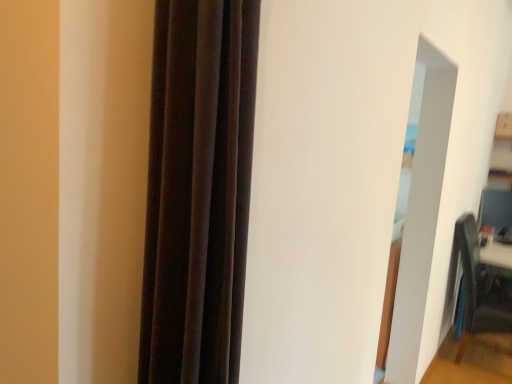
At what (x,y) coordinates should I click in order to perform the action: click on teal fabric armchair at lower right. Please return your answer as a coordinate pair (x, y). The height and width of the screenshot is (384, 512). Looking at the image, I should click on (471, 278).

The height and width of the screenshot is (384, 512). What do you see at coordinates (471, 278) in the screenshot? I see `teal fabric armchair at lower right` at bounding box center [471, 278].

What is the approximate height of teal fabric armchair at lower right?

1.07 meters.

Image resolution: width=512 pixels, height=384 pixels. Find the location of `teal fabric armchair at lower right`. teal fabric armchair at lower right is located at coordinates (471, 278).